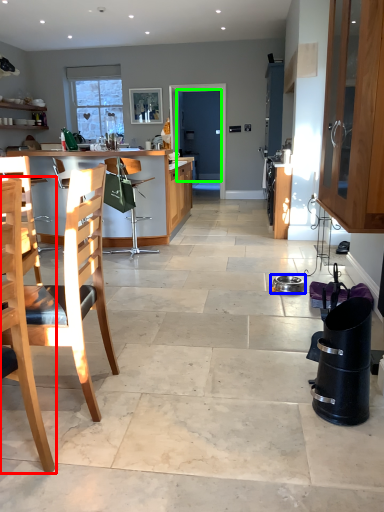
Question: Estimate the real-world distances between objects in this image. Which object is closer to chair (highlighted by a red box), appliance (highlighted by a blue box) or screen door (highlighted by a green box)?

Choices:
 (A) appliance
 (B) screen door

Answer: (A)